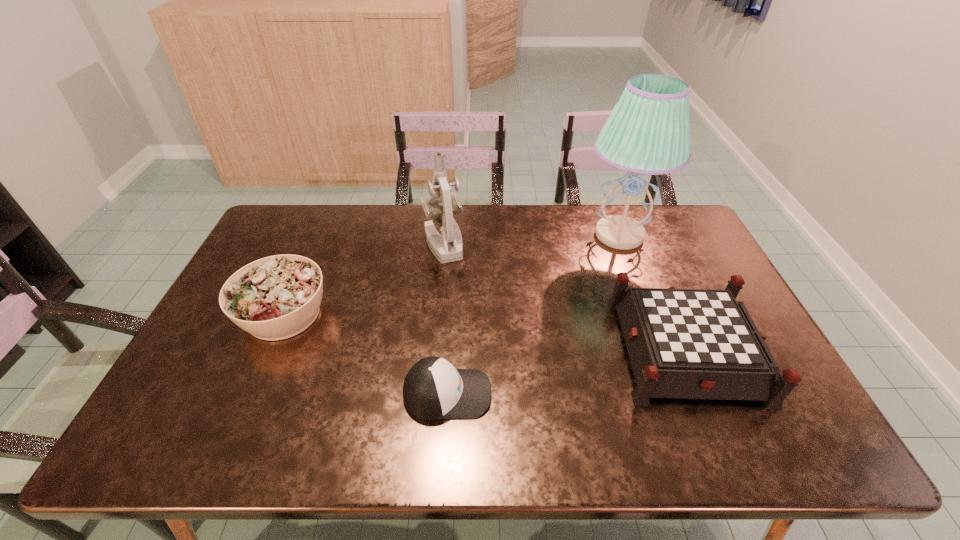
Image resolution: width=960 pixels, height=540 pixels. I want to click on vacant space at the right edge of the desktop, so click(x=741, y=412).

In the image, there is a desktop. Where is `vacant space at the near left corner`? The width and height of the screenshot is (960, 540). vacant space at the near left corner is located at coordinates (149, 450).

Locate an element on the screen. The image size is (960, 540). vacant space at the far right corner of the desktop is located at coordinates (686, 244).

Identify the location of free space that is in between the leftmost object and the checkerboard. This screenshot has height=540, width=960. (485, 331).

The width and height of the screenshot is (960, 540). Identify the location of vacant area that lies between the checkerboard and the shortest object. (566, 371).

Find the location of a particular element. Image resolution: width=960 pixels, height=540 pixels. blank region between the salad and the cap is located at coordinates (366, 354).

This screenshot has width=960, height=540. In order to click on vacant area between the shortest object and the tallest object in this screenshot , I will do `click(533, 314)`.

The image size is (960, 540). What are the coordinates of `free spot between the salad and the shortest object` in the screenshot? It's located at (366, 354).

Find the location of `vacant area that lies between the shortest object and the checkerboard`. vacant area that lies between the shortest object and the checkerboard is located at coordinates (566, 371).

Locate an element on the screen. free space between the checkerboard and the salad is located at coordinates (485, 331).